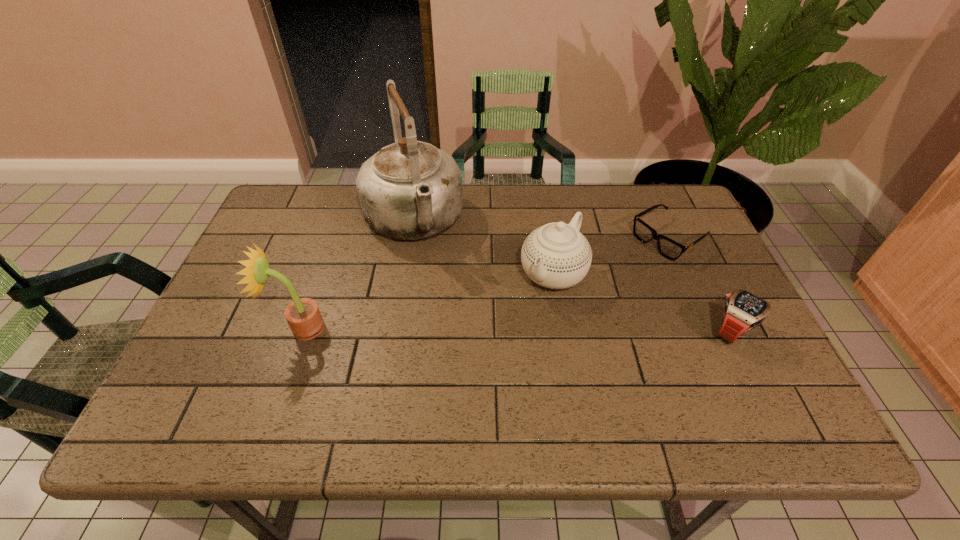
Locate an element on the screen. free space between the sunglasses and the third shortest object is located at coordinates click(611, 256).

Locate an element on the screen. empty location between the leftmost object and the kettle is located at coordinates (357, 274).

What are the coordinates of `free spot between the kettle and the leftmost object` in the screenshot? It's located at (357, 274).

Find the location of `empty location between the third object from left to right and the kettle`. empty location between the third object from left to right and the kettle is located at coordinates (483, 247).

The width and height of the screenshot is (960, 540). What are the coordinates of `unoccupied area between the chinaware and the shortest object` in the screenshot? It's located at (611, 256).

The height and width of the screenshot is (540, 960). Identify the location of empty space between the shortest object and the fourth tallest object. (701, 285).

This screenshot has height=540, width=960. In order to click on free point between the shortest object and the second tallest object in this screenshot , I will do `click(486, 283)`.

Identify the location of object that is the closest to the third object from left to right. (670, 249).

Where is `the third closest object relative to the shortest object`? Image resolution: width=960 pixels, height=540 pixels. the third closest object relative to the shortest object is located at coordinates (409, 190).

Where is `vacant space that satisfies the following two spatial constraints: 1. on the front side of the tallest object; 2. on the right side of the sunglasses`? vacant space that satisfies the following two spatial constraints: 1. on the front side of the tallest object; 2. on the right side of the sunglasses is located at coordinates (410, 239).